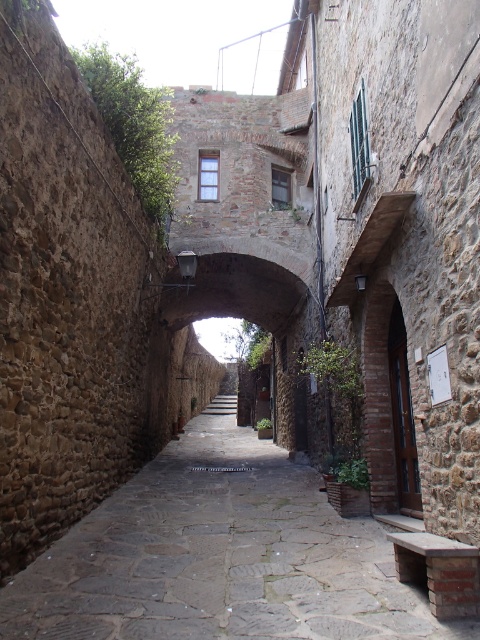
You are standing at the point marked as point [219,556] in the alleyway. What type of surface are you currently standing on?

You are standing on the stone paved alley at center located at point [219,556].

You are standing at the entrance of the stone paved alley at center and want to reach a historic building located 5 meters away. Can you walk straight ahead to reach it in one go?

The stone paved alley at center is 4.54 meters from viewer, so yes, you can walk straight ahead to reach the historic building located 5 meters away since the distance is within reach.